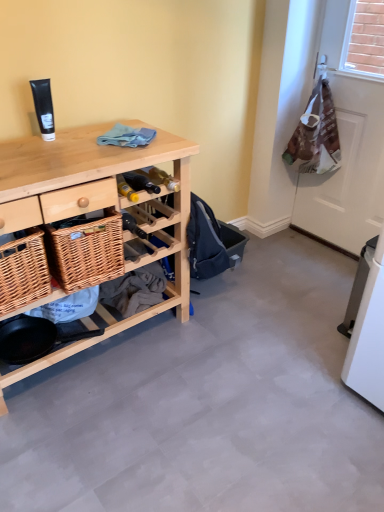
Question: Does brown paper bag at right have a lesser height compared to woven brown picnic basket at lower left?

Choices:
 (A) no
 (B) yes

Answer: (A)

Question: Does brown paper bag at right have a lesser width compared to woven brown picnic basket at lower left?

Choices:
 (A) no
 (B) yes

Answer: (B)

Question: Can you confirm if brown paper bag at right is bigger than woven brown picnic basket at lower left?

Choices:
 (A) yes
 (B) no

Answer: (A)

Question: Can you confirm if brown paper bag at right is positioned to the left of woven brown picnic basket at lower left?

Choices:
 (A) yes
 (B) no

Answer: (B)

Question: Is there a large distance between brown paper bag at right and woven brown picnic basket at lower left?

Choices:
 (A) yes
 (B) no

Answer: (A)

Question: Does point (117, 125) appear closer or farther from the camera than point (23, 243)?

Choices:
 (A) closer
 (B) farther

Answer: (B)

Question: From a real-world perspective, relative to woven brown picnic basket at lower left, is blue cotton cloth at center vertically above or below?

Choices:
 (A) above
 (B) below

Answer: (A)

Question: In the image, is blue cotton cloth at center positioned in front of or behind woven brown picnic basket at lower left?

Choices:
 (A) front
 (B) behind

Answer: (B)

Question: From the image's perspective, is blue cotton cloth at center positioned above or below woven brown picnic basket at lower left?

Choices:
 (A) below
 (B) above

Answer: (B)

Question: Considering their positions, is blue cotton cloth at center located in front of or behind brown paper bag at right?

Choices:
 (A) behind
 (B) front

Answer: (B)

Question: Would you say blue cotton cloth at center is to the left or to the right of brown paper bag at right in the picture?

Choices:
 (A) right
 (B) left

Answer: (B)

Question: In terms of size, does blue cotton cloth at center appear bigger or smaller than brown paper bag at right?

Choices:
 (A) big
 (B) small

Answer: (B)

Question: From a real-world perspective, is blue cotton cloth at center above or below brown paper bag at right?

Choices:
 (A) above
 (B) below

Answer: (A)

Question: From the image's perspective, relative to black matte tube at upper left, is natural wood desk at left above or below?

Choices:
 (A) below
 (B) above

Answer: (A)

Question: Is natural wood desk at left situated inside black matte tube at upper left or outside?

Choices:
 (A) inside
 (B) outside

Answer: (B)